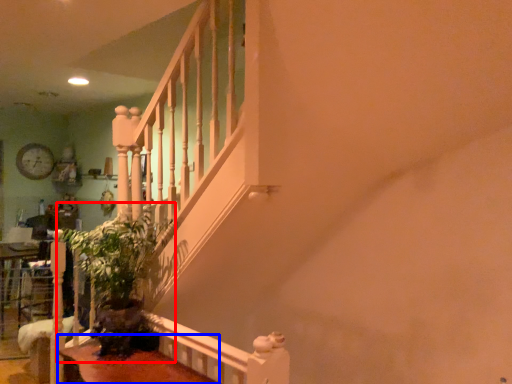
Question: Which object appears closest to the camera in this image, plant (highlighted by a red box) or table (highlighted by a blue box)?

Choices:
 (A) plant
 (B) table

Answer: (B)